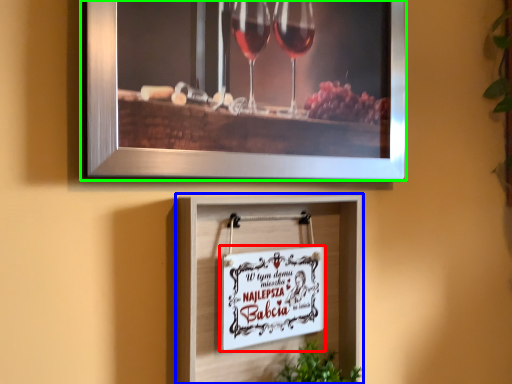
Question: Which object is positioned farthest from picture frame (highlighted by a red box)? Select from picture frame (highlighted by a blue box) and picture frame (highlighted by a green box).

Choices:
 (A) picture frame
 (B) picture frame

Answer: (B)